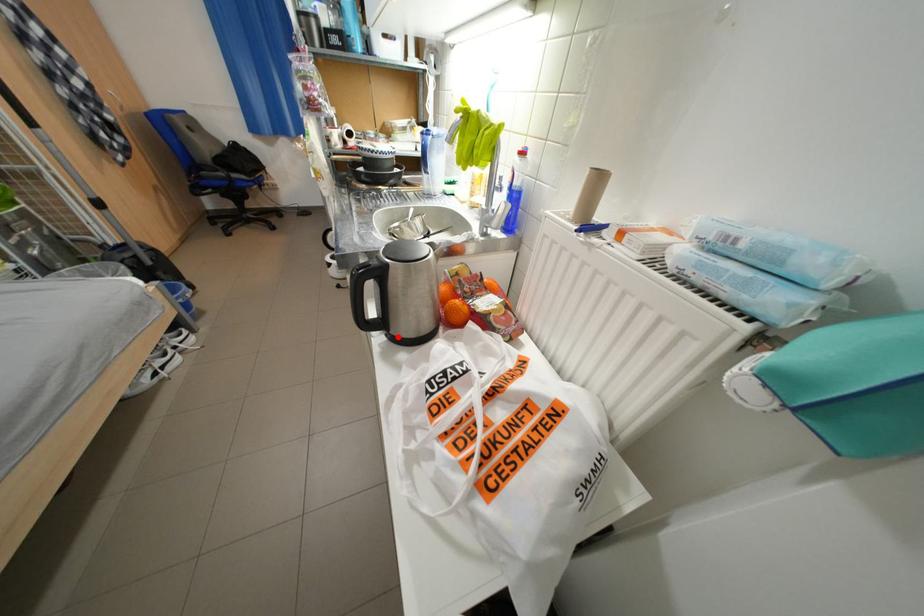
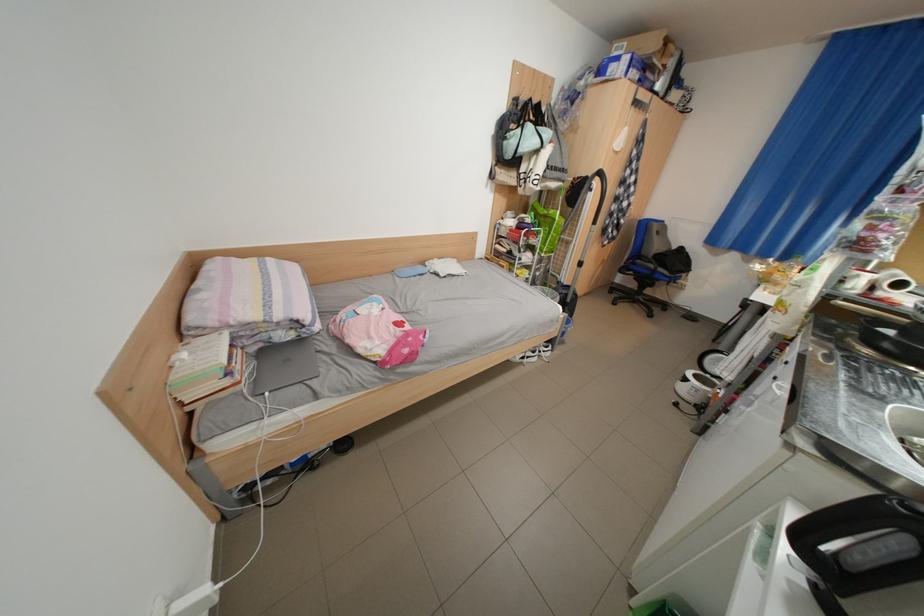
The point at the highlighted location is marked in the first image. Where is the corresponding point in the second image?

(825, 586)